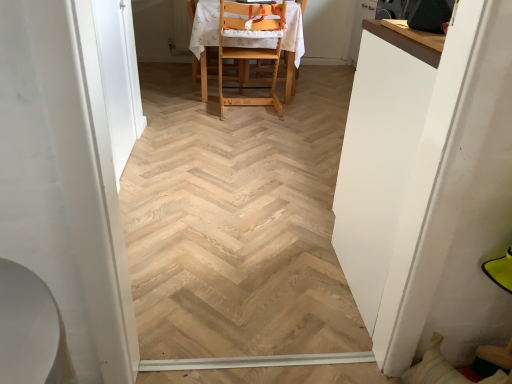
Question: Would you consider white glossy table at right to be distant from white glossy door at left, which is the 1th screen door from back to front?

Choices:
 (A) yes
 (B) no

Answer: (A)

Question: Can we say white glossy table at right lies outside white glossy door at left, acting as the second screen door starting from the front?

Choices:
 (A) yes
 (B) no

Answer: (A)

Question: From a real-world perspective, is white glossy table at right located higher than white glossy door at left, which is the 1th screen door from back to front?

Choices:
 (A) yes
 (B) no

Answer: (A)

Question: From the image's perspective, is white glossy table at right beneath white glossy door at left, acting as the second screen door starting from the front?

Choices:
 (A) yes
 (B) no

Answer: (A)

Question: Is white glossy table at right turned away from white glossy door at left, which is the 1th screen door from back to front?

Choices:
 (A) no
 (B) yes

Answer: (A)

Question: From the image's perspective, is white glossy table at right positioned above or below white glossy door at left, acting as the second screen door starting from the front?

Choices:
 (A) below
 (B) above

Answer: (A)

Question: From a real-world perspective, is white glossy table at right physically located above or below white glossy door at left, acting as the second screen door starting from the front?

Choices:
 (A) above
 (B) below

Answer: (A)

Question: Looking at their shapes, would you say white glossy table at right is wider or thinner than white glossy door at left, acting as the second screen door starting from the front?

Choices:
 (A) wide
 (B) thin

Answer: (A)

Question: Considering the positions of point (367, 157) and point (103, 39), is point (367, 157) closer or farther from the camera than point (103, 39)?

Choices:
 (A) farther
 (B) closer

Answer: (B)

Question: From a real-world perspective, relative to white glossy screen door at left, arranged as the first screen door when viewed from the front, is white glossy door at left, acting as the second screen door starting from the front, vertically above or below?

Choices:
 (A) above
 (B) below

Answer: (B)

Question: Is point (133, 79) positioned closer to the camera than point (8, 177)?

Choices:
 (A) closer
 (B) farther

Answer: (B)

Question: Is white glossy door at left, which is the 1th screen door from back to front, wider or thinner than white glossy screen door at left, arranged as the first screen door when viewed from the front?

Choices:
 (A) wide
 (B) thin

Answer: (B)

Question: Is white glossy door at left, which is the 1th screen door from back to front, bigger or smaller than white glossy screen door at left, arranged as the first screen door when viewed from the front?

Choices:
 (A) small
 (B) big

Answer: (A)

Question: Considering the relative positions of light wood highchair at center and white glossy screen door at left, arranged as the first screen door when viewed from the front, in the image provided, is light wood highchair at center to the left or to the right of white glossy screen door at left, arranged as the first screen door when viewed from the front,?

Choices:
 (A) right
 (B) left

Answer: (A)

Question: From a real-world perspective, is light wood highchair at center above or below white glossy screen door at left, arranged as the first screen door when viewed from the front?

Choices:
 (A) below
 (B) above

Answer: (A)